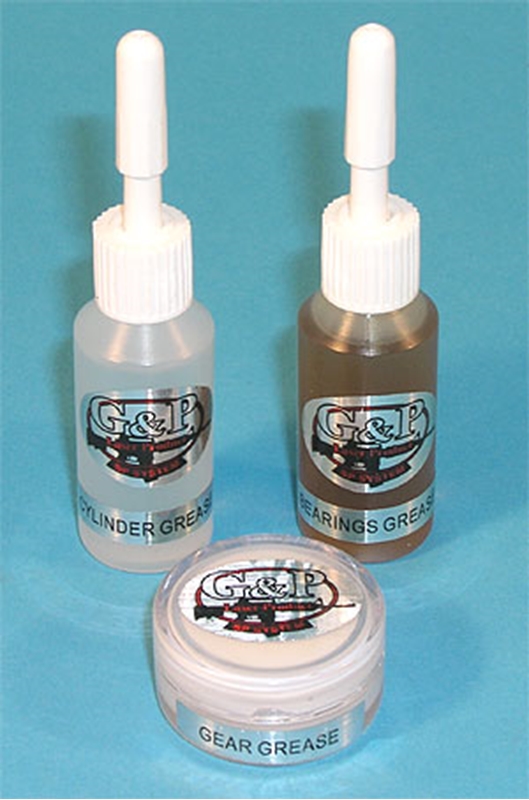
The width and height of the screenshot is (529, 800). What are the coordinates of `bottles` in the screenshot? It's located at (154, 500), (367, 504).